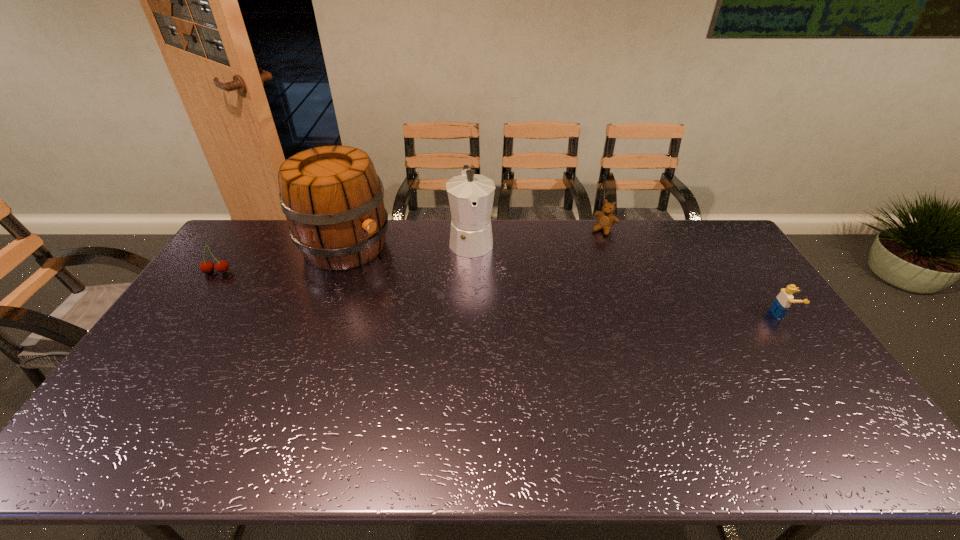
In order to click on free space between the third object from right to left and the nearest object in this screenshot , I will do `click(627, 277)`.

I want to click on free space between the Lego and the second object from left to right, so click(x=564, y=280).

Where is `vacant area that lies between the cider and the coffeepot`? Image resolution: width=960 pixels, height=540 pixels. vacant area that lies between the cider and the coffeepot is located at coordinates (408, 243).

At what (x,y) coordinates should I click in order to perform the action: click on the fourth closest object to the third object from left to right. Please return your answer as a coordinate pair (x, y). The width and height of the screenshot is (960, 540). Looking at the image, I should click on (783, 301).

I want to click on the closest object relative to the second object from right to left, so click(x=470, y=195).

Locate an element on the screen. The width and height of the screenshot is (960, 540). free space that satisfies the following two spatial constraints: 1. on the back side of the teddy bear; 2. on the right side of the coffeepot is located at coordinates (471, 230).

Locate an element on the screen. The image size is (960, 540). vacant region that satisfies the following two spatial constraints: 1. on the back side of the cider; 2. on the right side of the fourth object from left to right is located at coordinates (351, 230).

Locate an element on the screen. free region that satisfies the following two spatial constraints: 1. on the back side of the coffeepot; 2. on the left side of the cider is located at coordinates (348, 240).